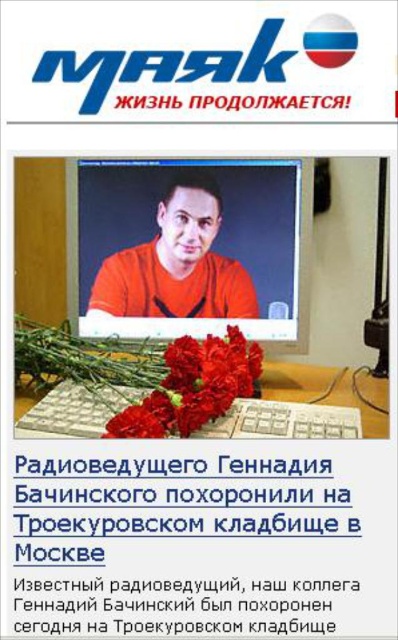
You are a photographer standing 5 feet away from the monitor. You want to take a closeup shot of the orange matte shirt at center. Will you be able to focus on the shirt without moving closer?

The orange matte shirt at center is 3.53 feet away from the viewer. Since you are standing 5 feet away, you are farther than the shirt. Most cameras can focus at that distance, so yes, you can take the closeup without moving closer.

You are setting up a desk and notice two keyboards in the image. Which keyboard, the matte plastic keyboard at lower center or the white plastic keyboard at lower center, is positioned higher?

The matte plastic keyboard at lower center is positioned higher because it is above the white plastic keyboard at lower center.

You are looking at the image of a news article with a computer monitor showing a man in an orange shirt. There is a matte plastic keyboard at lower center. Can you determine the position of the matte plastic keyboard relative to the computer monitor?

The matte plastic keyboard at lower center is located at point (282, 420) on the image, which places it at the lower center position relative to the computer monitor.